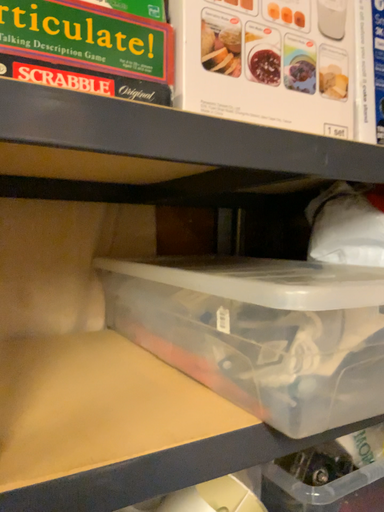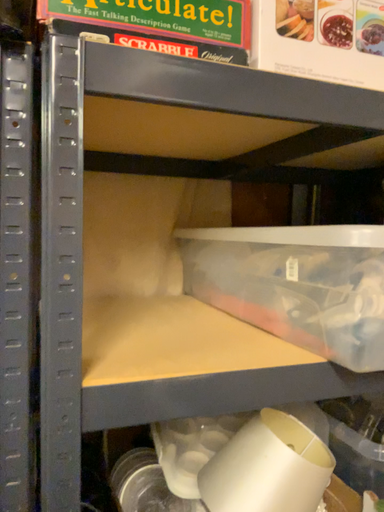
Question: Which way did the camera rotate in the video?

Choices:
 (A) rotated right
 (B) rotated left

Answer: (B)